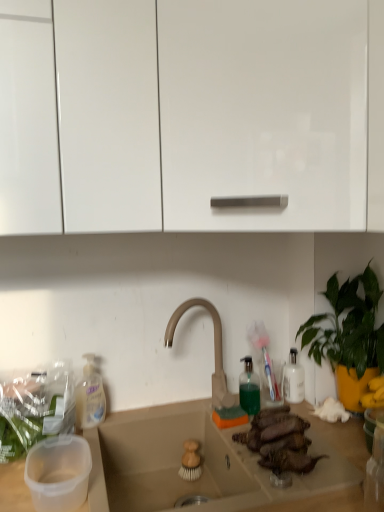
Question: Considering the relative sizes of transparent plastic soap dispenser at lower left, the 1th bottle viewed from the left, and beige matte countertop at center in the image provided, is transparent plastic soap dispenser at lower left, the 1th bottle viewed from the left, bigger than beige matte countertop at center?

Choices:
 (A) yes
 (B) no

Answer: (B)

Question: From the image's perspective, is transparent plastic soap dispenser at lower left, which is counted as the 2th bottle, starting from the right, over beige matte countertop at center?

Choices:
 (A) yes
 (B) no

Answer: (A)

Question: Is transparent plastic soap dispenser at lower left, the 1th bottle viewed from the left, facing away from beige matte countertop at center?

Choices:
 (A) no
 (B) yes

Answer: (A)

Question: From a real-world perspective, is transparent plastic soap dispenser at lower left, which is counted as the 2th bottle, starting from the right, physically above beige matte countertop at center?

Choices:
 (A) no
 (B) yes

Answer: (B)

Question: Is transparent plastic soap dispenser at lower left, the 1th bottle viewed from the left, at the right side of beige matte countertop at center?

Choices:
 (A) yes
 (B) no

Answer: (B)

Question: Could beige matte countertop at center be considered to be inside transparent plastic soap dispenser at lower left, the 1th bottle viewed from the left?

Choices:
 (A) no
 (B) yes

Answer: (A)

Question: Is white glossy cabinet at upper left, the first cabinetry in the left-to-right sequence, taller than beige matte countertop at center?

Choices:
 (A) yes
 (B) no

Answer: (A)

Question: From a real-world perspective, is white glossy cabinet at upper left, the first cabinetry in the left-to-right sequence, over beige matte countertop at center?

Choices:
 (A) yes
 (B) no

Answer: (A)

Question: From a real-world perspective, is white glossy cabinet at upper left, arranged as the second cabinetry when viewed from the right, under beige matte countertop at center?

Choices:
 (A) no
 (B) yes

Answer: (A)

Question: Can you confirm if white glossy cabinet at upper left, arranged as the second cabinetry when viewed from the right, is bigger than beige matte countertop at center?

Choices:
 (A) no
 (B) yes

Answer: (B)

Question: Can you confirm if white glossy cabinet at upper left, arranged as the second cabinetry when viewed from the right, is thinner than beige matte countertop at center?

Choices:
 (A) no
 (B) yes

Answer: (B)

Question: Can you confirm if white glossy cabinet at upper left, the first cabinetry in the left-to-right sequence, is wider than beige matte countertop at center?

Choices:
 (A) yes
 (B) no

Answer: (B)

Question: From the image's perspective, is brown matte meat at center on glossy white cabinet at upper center, which is the 1th cabinetry from right to left?

Choices:
 (A) yes
 (B) no

Answer: (B)